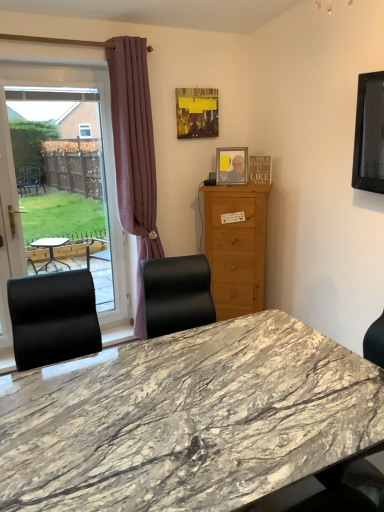
Image resolution: width=384 pixels, height=512 pixels. What do you see at coordinates (103, 147) in the screenshot?
I see `transparent glass window at left` at bounding box center [103, 147].

The image size is (384, 512). What are the coordinates of `matte plastic picture frame at upper center, the 2th picture frame from the left` in the screenshot? It's located at (x=232, y=165).

What is the approximate height of marble table at center?

marble table at center is 78.77 centimeters tall.

This screenshot has height=512, width=384. What do you see at coordinates (187, 419) in the screenshot? I see `marble table at center` at bounding box center [187, 419].

At what (x,y) coordinates should I click in order to perform the action: click on mauve velvet curtain at left. Please return your answer as a coordinate pair (x, y). Image resolution: width=384 pixels, height=512 pixels. Looking at the image, I should click on (134, 154).

What are the coordinates of `transparent glass window at left` in the screenshot? It's located at (103, 147).

Is light brown wood cabinet at center situated inside matte white screen door at left or outside?

light brown wood cabinet at center lies outside matte white screen door at left.

Is light brown wood cabinet at center aimed at matte white screen door at left?

No, light brown wood cabinet at center does not turn towards matte white screen door at left.

Would you say light brown wood cabinet at center is to the left or to the right of matte white screen door at left in the picture?

Clearly, light brown wood cabinet at center is on the right of matte white screen door at left in the image.

From the image's perspective, is light brown wood cabinet at center below matte white screen door at left?

No, from the image's perspective, light brown wood cabinet at center is not beneath matte white screen door at left.

From a real-world perspective, which is physically above, light brown wood cabinet at center or marble table at center?

light brown wood cabinet at center.

From the picture: Considering the relative sizes of light brown wood cabinet at center and marble table at center in the image provided, is light brown wood cabinet at center bigger than marble table at center?

Incorrect, light brown wood cabinet at center is not larger than marble table at center.

What's the angular difference between light brown wood cabinet at center and marble table at center's facing directions?

The angular difference between light brown wood cabinet at center and marble table at center is 132 degrees.

Which object is further away from the camera taking this photo, light brown wood cabinet at center or marble table at center?

Positioned behind is light brown wood cabinet at center.

From the image's perspective, is matte plastic picture frame at upper center, which appears as the second picture frame when viewed from the top, positioned above or below marble table at center?

matte plastic picture frame at upper center, which appears as the second picture frame when viewed from the top, is above marble table at center.

Who is smaller, matte plastic picture frame at upper center, which appears as the second picture frame when viewed from the top, or marble table at center?

With smaller size is matte plastic picture frame at upper center, which appears as the second picture frame when viewed from the top.

Which is more to the right, matte plastic picture frame at upper center, which is the first picture frame from right to left, or marble table at center?

matte plastic picture frame at upper center, which is the first picture frame from right to left, is more to the right.

From the image's perspective, between matte white screen door at left and transparent glass window at left, who is located below?

matte white screen door at left appears lower in the image.

Does point (10, 274) come closer to viewer compared to point (111, 177)?

Yes, point (10, 274) is in front of point (111, 177).

From a real-world perspective, who is located higher, matte white screen door at left or transparent glass window at left?

From a 3D spatial view, transparent glass window at left is above.

The height and width of the screenshot is (512, 384). There is a matte white screen door at left. Find the location of `window above it (from a real-world perspective)`. window above it (from a real-world perspective) is located at coordinates (103, 147).

Choose the correct answer: Is mauve velvet curtain at left inside matte white screen door at left or outside it?

mauve velvet curtain at left is spatially situated outside matte white screen door at left.

From the image's perspective, between mauve velvet curtain at left and matte white screen door at left, which one is located above?

mauve velvet curtain at left.

Can you see mauve velvet curtain at left touching matte white screen door at left?

No, mauve velvet curtain at left is not in contact with matte white screen door at left.

Is matte yellow picture frame at upper center, the first picture frame viewed from the top, inside or outside of light brown wood cabinet at center?

matte yellow picture frame at upper center, the first picture frame viewed from the top, is located beyond the bounds of light brown wood cabinet at center.

Who is smaller, matte yellow picture frame at upper center, the first picture frame viewed from the top, or light brown wood cabinet at center?

Smaller between the two is matte yellow picture frame at upper center, the first picture frame viewed from the top.

The image size is (384, 512). I want to click on cabinetry that is in front of the matte yellow picture frame at upper center, the first picture frame viewed from the top, so click(236, 247).

From the image's perspective, is transparent glass window at left positioned above or below light brown wood cabinet at center?

transparent glass window at left is above light brown wood cabinet at center.

In the scene shown: Is transparent glass window at left not within light brown wood cabinet at center?

Yes, transparent glass window at left is not within light brown wood cabinet at center.

Is transparent glass window at left closer to the viewer compared to light brown wood cabinet at center?

Yes, transparent glass window at left is in front of light brown wood cabinet at center.

From their relative heights in the image, would you say transparent glass window at left is taller or shorter than light brown wood cabinet at center?

transparent glass window at left is taller than light brown wood cabinet at center.

This screenshot has height=512, width=384. Identify the location of cabinetry that appears below the matte white screen door at left (from a real-world perspective). (236, 247).

Find the location of a particular element. This screenshot has width=384, height=512. cabinetry on the right of marble table at center is located at coordinates (236, 247).

From the picture: Based on their spatial positions, is matte yellow picture frame at upper center, which is counted as the second picture frame, starting from the right, or matte white screen door at left further from marble table at center?

matte yellow picture frame at upper center, which is counted as the second picture frame, starting from the right, is positioned further to the anchor marble table at center.

Based on their spatial positions, is matte plastic picture frame at upper center, which is the first picture frame from right to left, or matte white screen door at left further from marble table at center?

Among the two, matte plastic picture frame at upper center, which is the first picture frame from right to left, is located further to marble table at center.

Looking at the image, which one is located closer to transparent glass window at left, mauve velvet curtain at left or matte white screen door at left?

mauve velvet curtain at left lies closer to transparent glass window at left than the other object.

Considering their positions, is mauve velvet curtain at left positioned further to light brown wood cabinet at center than matte yellow picture frame at upper center, the 2th picture frame ordered from the bottom?

Based on the image, matte yellow picture frame at upper center, the 2th picture frame ordered from the bottom, appears to be further to light brown wood cabinet at center.

Estimate the real-world distances between objects in this image. Which object is closer to matte plastic picture frame at upper center, which appears as the second picture frame when viewed from the top, mauve velvet curtain at left or matte white screen door at left?

mauve velvet curtain at left lies closer to matte plastic picture frame at upper center, which appears as the second picture frame when viewed from the top, than the other object.

Estimate the real-world distances between objects in this image. Which object is closer to mauve velvet curtain at left, light brown wood cabinet at center or matte white screen door at left?

light brown wood cabinet at center is closer to mauve velvet curtain at left.

When comparing their distances from matte plastic picture frame at upper center, which appears as the second picture frame when viewed from the top, does marble table at center or light brown wood cabinet at center seem further?

marble table at center is positioned further to the anchor matte plastic picture frame at upper center, which appears as the second picture frame when viewed from the top.

Estimate the real-world distances between objects in this image. Which object is closer to mauve velvet curtain at left, marble table at center or light brown wood cabinet at center?

light brown wood cabinet at center is closer to mauve velvet curtain at left.

Identify the location of curtain between matte white screen door at left and matte yellow picture frame at upper center, the first picture frame viewed from the top, from left to right. click(134, 154).

Locate an element on the screen. The width and height of the screenshot is (384, 512). curtain between marble table at center and matte yellow picture frame at upper center, the first picture frame viewed from the top, in the front-back direction is located at coordinates (134, 154).

This screenshot has height=512, width=384. I want to click on curtain between marble table at center and matte white screen door at left along the z-axis, so (134, 154).

Locate an element on the screen. window between marble table at center and matte white screen door at left in the front-back direction is located at coordinates (103, 147).